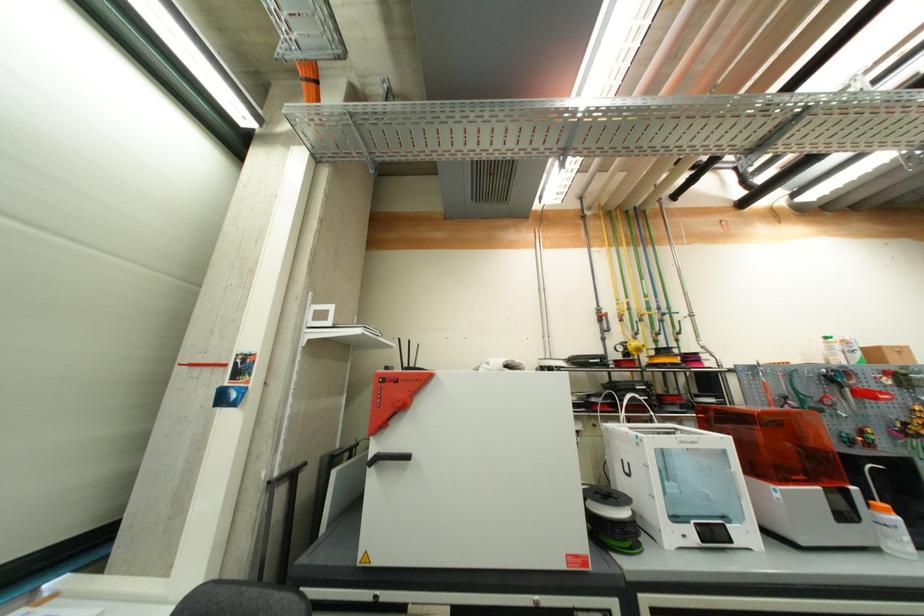
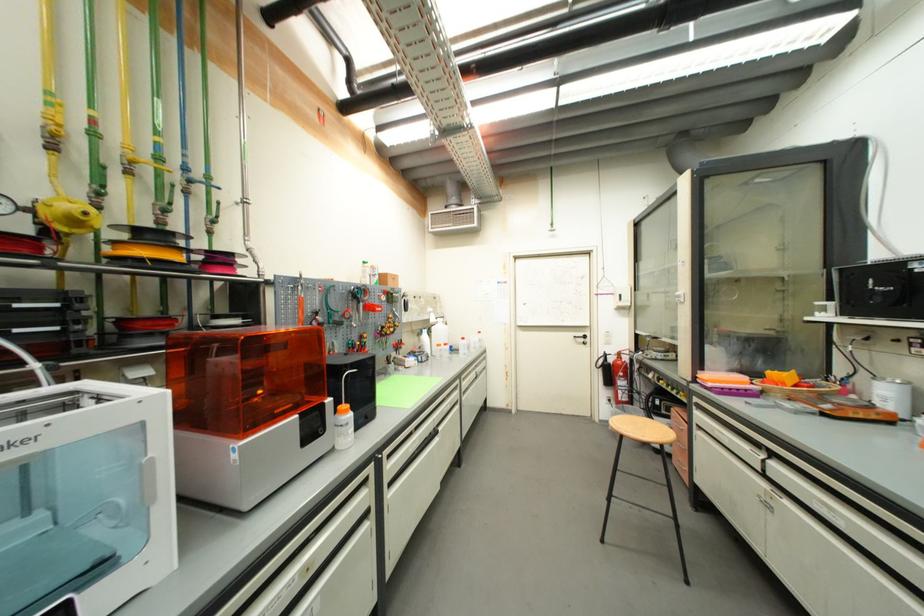
Locate, in the second image, the point that corresponds to [643,351] in the first image.

(82, 224)